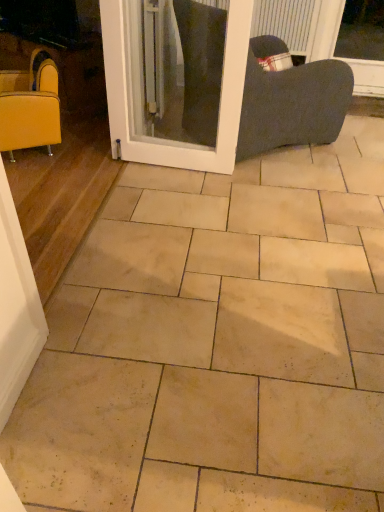
In order to click on vacant space to the right of matte yellow armchair at left in this screenshot , I will do `click(85, 152)`.